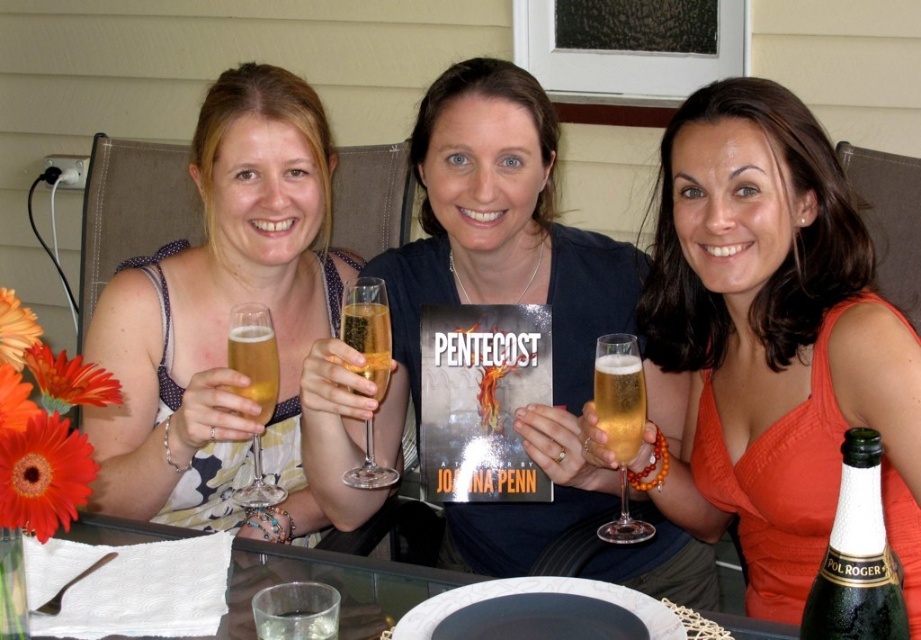
Question: Does matte floral dress at center appear on the left side of clear glass champagne flute at center?

Choices:
 (A) no
 (B) yes

Answer: (B)

Question: Where is matte floral dress at center located in relation to green glass bottle at lower right in the image?

Choices:
 (A) below
 (B) above

Answer: (B)

Question: Which point is farther to the camera?

Choices:
 (A) orange fabric dress at center
 (B) matte floral dress at center

Answer: (B)

Question: Considering the real-world distances, which object is farthest from the matte floral dress at center?

Choices:
 (A) green glass bottle at lower right
 (B) golden glass champagne flute at center

Answer: (A)

Question: Is transparent glass table at center to the left of golden glass champagne flute at center from the viewer's perspective?

Choices:
 (A) yes
 (B) no

Answer: (A)

Question: Estimate the real-world distances between objects in this image. Which object is closer to the green glass bottle at lower right?

Choices:
 (A) matte floral dress at center
 (B) golden glass beer at center

Answer: (B)